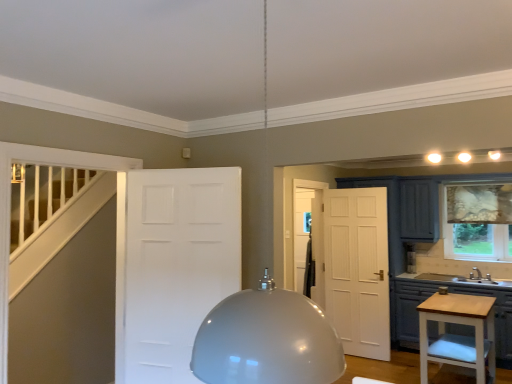
Describe the element at coordinates (478, 221) in the screenshot. The width and height of the screenshot is (512, 384). I see `patterned fabric curtain at right` at that location.

Describe the element at coordinates (177, 264) in the screenshot. Image resolution: width=512 pixels, height=384 pixels. I see `white matte door at center` at that location.

Find the location of a particular element. This screenshot has height=384, width=512. white matte door at center is located at coordinates (177, 264).

At what (x,y) coordinates should I click in order to perform the action: click on patterned fabric curtain at right. Please return your answer as a coordinate pair (x, y). The image size is (512, 384). Looking at the image, I should click on (478, 221).

Consider the image. Measure the distance from matte gray cabinets at lower right to light wood vanity at lower right.

3.92 feet.

Does matte gray cabinets at lower right appear on the right side of light wood vanity at lower right?

Yes.

Is matte gray cabinets at lower right outside of light wood vanity at lower right?

matte gray cabinets at lower right is positioned outside light wood vanity at lower right.

Is light wood vanity at lower right at the back of matte gray cabinets at lower right?

No, matte gray cabinets at lower right is not facing the opposite direction of light wood vanity at lower right.

From the image's perspective, which object appears higher, matte gray cabinets at lower right or patterned fabric curtain at right?

patterned fabric curtain at right.

From a real-world perspective, is matte gray cabinets at lower right below patterned fabric curtain at right?

Yes, from a real-world perspective, matte gray cabinets at lower right is under patterned fabric curtain at right.

Consider the image. Considering the positions of objects matte gray cabinets at lower right and patterned fabric curtain at right in the image provided, who is more to the right, matte gray cabinets at lower right or patterned fabric curtain at right?

Positioned to the right is patterned fabric curtain at right.

Between matte gray cabinets at lower right and patterned fabric curtain at right, which one is positioned in front?

matte gray cabinets at lower right is more forward.

Identify the location of door on the left of the patterned fabric curtain at right. (177, 264).

Considering the relative sizes of white matte door at center and patterned fabric curtain at right in the image provided, is white matte door at center taller than patterned fabric curtain at right?

Yes, white matte door at center is taller than patterned fabric curtain at right.

From the image's perspective, is white matte door at center under patterned fabric curtain at right?

No, from the image's perspective, white matte door at center is not below patterned fabric curtain at right.

Considering the relative sizes of white matte door at center and patterned fabric curtain at right in the image provided, is white matte door at center smaller than patterned fabric curtain at right?

Incorrect, white matte door at center is not smaller in size than patterned fabric curtain at right.

Is point (478, 319) closer to viewer compared to point (493, 296)?

That is True.

Considering the sizes of objects light wood vanity at lower right and matte gray cabinets at lower right in the image provided, who is thinner, light wood vanity at lower right or matte gray cabinets at lower right?

light wood vanity at lower right.

Could you tell me if light wood vanity at lower right is turned towards matte gray cabinets at lower right?

No, light wood vanity at lower right is not aimed at matte gray cabinets at lower right.

Which is behind, light wood vanity at lower right or matte gray cabinets at lower right?

matte gray cabinets at lower right is more distant.

Between patterned fabric curtain at right and light wood vanity at lower right, which one has larger width?

Wider between the two is light wood vanity at lower right.

Which of these two, patterned fabric curtain at right or light wood vanity at lower right, stands shorter?

light wood vanity at lower right is shorter.

From the image's perspective, which object appears higher, patterned fabric curtain at right or light wood vanity at lower right?

patterned fabric curtain at right, from the image's perspective.

Between patterned fabric curtain at right and light wood vanity at lower right, which one appears on the right side from the viewer's perspective?

patterned fabric curtain at right.

In terms of size, does matte gray cabinets at lower right appear bigger or smaller than white matte door at center?

Considering their sizes, matte gray cabinets at lower right takes up more space than white matte door at center.

Is matte gray cabinets at lower right not close to white matte door at center?

That's right, there is a large distance between matte gray cabinets at lower right and white matte door at center.

Which object is positioned more to the right, matte gray cabinets at lower right or white matte door at center?

matte gray cabinets at lower right.

Which object is positioned more to the right, light wood vanity at lower right or patterned fabric curtain at right?

patterned fabric curtain at right is more to the right.

Is light wood vanity at lower right not within patterned fabric curtain at right?

That's correct, light wood vanity at lower right is outside of patterned fabric curtain at right.

Is light wood vanity at lower right touching patterned fabric curtain at right?

No.

Is light wood vanity at lower right in front of or behind patterned fabric curtain at right in the image?

light wood vanity at lower right is positioned closer to the viewer than patterned fabric curtain at right.

At what (x,y) coordinates should I click in order to perform the action: click on cabinetry located underneath the light wood vanity at lower right (from a real-world perspective). Please return your answer as a coordinate pair (x, y). The height and width of the screenshot is (384, 512). Looking at the image, I should click on (449, 292).

Locate an element on the screen. The width and height of the screenshot is (512, 384). cabinetry on the left of patterned fabric curtain at right is located at coordinates click(449, 292).

In the scene shown: Looking at the image, which one is located closer to patterned fabric curtain at right, matte gray cabinets at lower right or light wood vanity at lower right?

The object closer to patterned fabric curtain at right is matte gray cabinets at lower right.

When comparing their distances from matte gray cabinets at lower right, does patterned fabric curtain at right or light wood vanity at lower right seem further?

light wood vanity at lower right is further to matte gray cabinets at lower right.

When comparing their distances from white matte door at center, does patterned fabric curtain at right or matte gray cabinets at lower right seem further?

patterned fabric curtain at right is positioned further to the anchor white matte door at center.

Based on their spatial positions, is white matte door at center or light wood vanity at lower right closer to matte gray cabinets at lower right?

The object closer to matte gray cabinets at lower right is light wood vanity at lower right.

Considering their positions, is light wood vanity at lower right positioned further to matte gray cabinets at lower right than white matte door at center?

white matte door at center is positioned further to the anchor matte gray cabinets at lower right.

Considering their positions, is patterned fabric curtain at right positioned closer to light wood vanity at lower right than white matte door at center?

Based on the image, patterned fabric curtain at right appears to be nearer to light wood vanity at lower right.

Considering their positions, is patterned fabric curtain at right positioned closer to matte gray cabinets at lower right than white matte door at center?

patterned fabric curtain at right is positioned closer to the anchor matte gray cabinets at lower right.

When comparing their distances from white matte door at center, does light wood vanity at lower right or patterned fabric curtain at right seem closer?

Among the two, light wood vanity at lower right is located nearer to white matte door at center.

Where is `cabinetry situated between white matte door at center and patterned fabric curtain at right from left to right`? This screenshot has height=384, width=512. cabinetry situated between white matte door at center and patterned fabric curtain at right from left to right is located at coordinates (449, 292).

Where is `vanity located between white matte door at center and matte gray cabinets at lower right in the left-right direction`? This screenshot has height=384, width=512. vanity located between white matte door at center and matte gray cabinets at lower right in the left-right direction is located at coordinates (458, 335).

Image resolution: width=512 pixels, height=384 pixels. Find the location of `cabinetry between light wood vanity at lower right and patterned fabric curtain at right from front to back`. cabinetry between light wood vanity at lower right and patterned fabric curtain at right from front to back is located at coordinates (449, 292).

This screenshot has width=512, height=384. I want to click on vanity located between white matte door at center and patterned fabric curtain at right in the left-right direction, so [x=458, y=335].